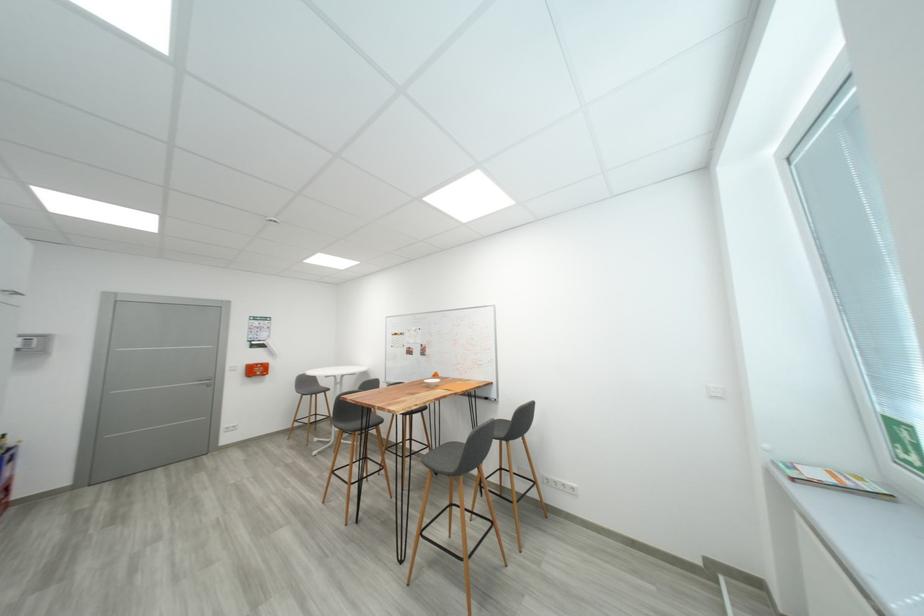
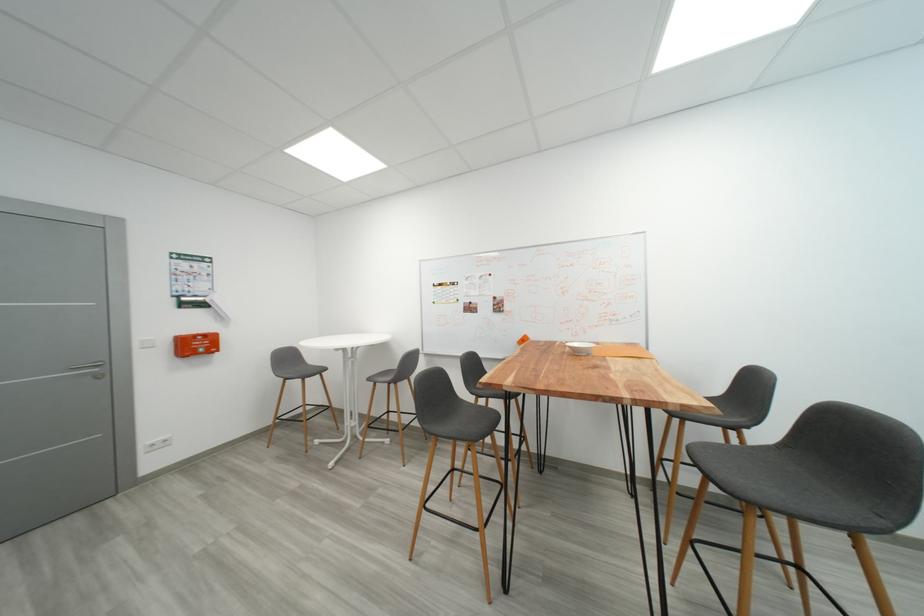
Where in the second image is the point corresponding to the point at 263,373 from the first image?

(203, 347)